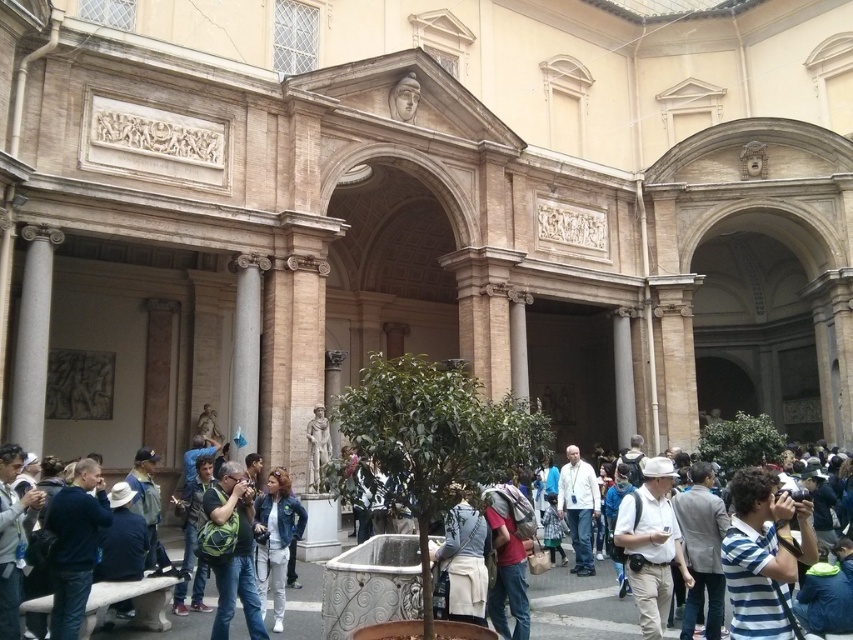
Between point (74, 522) and point (299, 522), which one is positioned behind?

The point (299, 522) is behind.

Measure the distance between point (x=61, y=502) and camera.

Point (x=61, y=502) and camera are 31.23 meters apart from each other.

The height and width of the screenshot is (640, 853). Find the location of `dark blue jacket at center`. dark blue jacket at center is located at coordinates (74, 545).

Where is `dark blue jacket at center`? dark blue jacket at center is located at coordinates tap(74, 545).

Between striped cotton shirt at center and matte green backpack at center, which one appears on the left side from the viewer's perspective?

Positioned to the left is matte green backpack at center.

The image size is (853, 640). What do you see at coordinates (762, 554) in the screenshot?
I see `striped cotton shirt at center` at bounding box center [762, 554].

Who is more forward, (744, 596) or (250, 614)?

Point (744, 596) is more forward.

Where is `striped cotton shirt at center`? The height and width of the screenshot is (640, 853). striped cotton shirt at center is located at coordinates (762, 554).

Can you confirm if striped cotton shirt at center is wider than white cotton jacket at center?

Yes.

Can you confirm if striped cotton shirt at center is positioned above white cotton jacket at center?

Yes, striped cotton shirt at center is above white cotton jacket at center.

Who is more distant from viewer, (775, 611) or (469, 582)?

Positioned behind is point (469, 582).

You are a GUI agent. You are given a task and a screenshot of the screen. Output one action in this format:
    pyautogui.click(x=<x>, y=<y>)
    Task: Click on the striped cotton shirt at center
    
    Given the screenshot: What is the action you would take?
    pos(762,554)